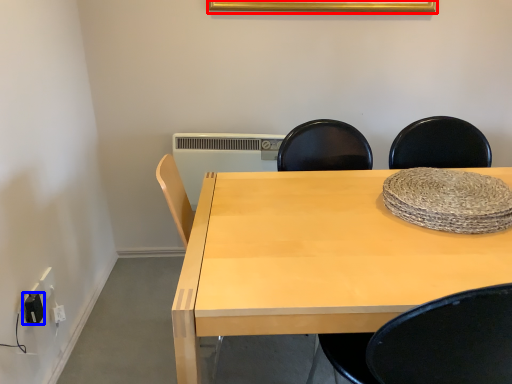
Question: Which of the following is the closest to the observer, picture frame (highlighted by a red box) or electric outlet (highlighted by a blue box)?

Choices:
 (A) picture frame
 (B) electric outlet

Answer: (B)